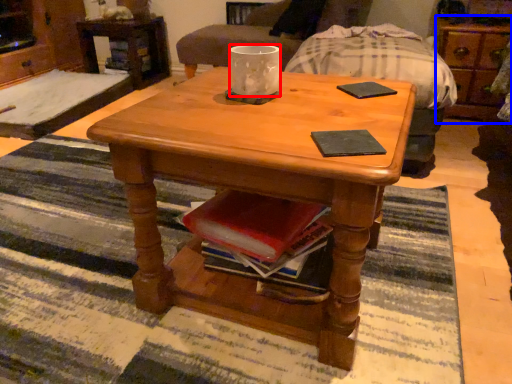
Question: Among these objects, which one is nearest to the camera, coffee cup (highlighted by a red box) or dresser (highlighted by a blue box)?

Choices:
 (A) coffee cup
 (B) dresser

Answer: (A)